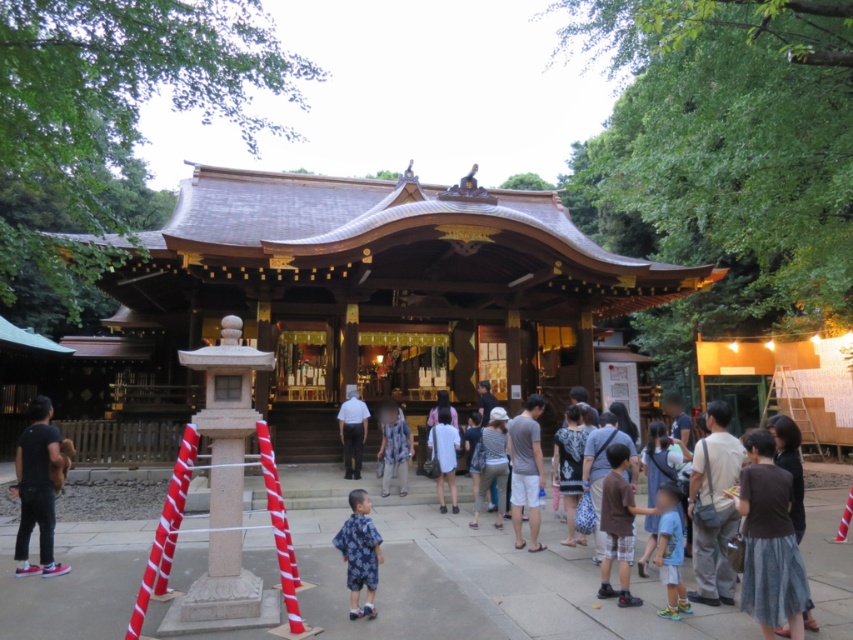
You are visiting a traditional Japanese shrine and notice two shirts in the scene. The blue printed shirt at lower center and the white cotton shirt at center. Which shirt is positioned to the right of the other?

The blue printed shirt at lower center is to the right of the white cotton shirt at center.

You are a photographer wanting to capture both the blue printed shirt at lower center and the white cotton shirt at center in a single shot. Which shirt should you focus on first to ensure both are in frame?

You should focus on the white cotton shirt at center first because the blue printed shirt at lower center is in front of it, ensuring both will be in frame when starting from the back.

You are a photographer planning to take a picture of the shrine. You notice two shirts hanging on a rack near the entrance. The shirts are the blue printed shirt at lower center and the blue plaid shirt at center. Which shirt should you avoid including in your photo to ensure the shrine remains the main focus, considering their positions?

The blue printed shirt at lower center is shorter than the blue plaid shirt at center. Since the shorter shirt might be less likely to obstruct the shrine, you should avoid including the taller blue plaid shirt at center to keep the shrine as the main focus.